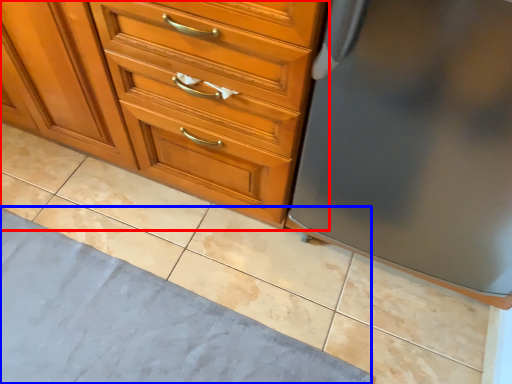
Question: Which of the following is the closest to the observer, chest of drawers (highlighted by a red box) or bath mat (highlighted by a blue box)?

Choices:
 (A) chest of drawers
 (B) bath mat

Answer: (A)